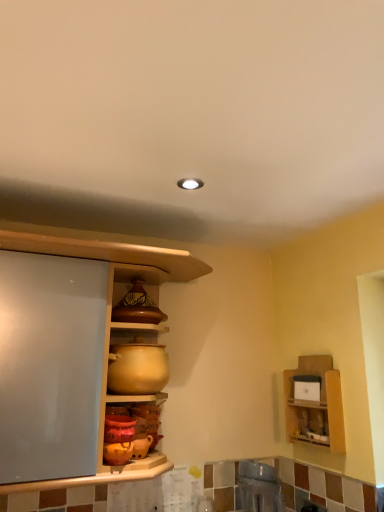
Question: From the image's perspective, is metallic stainless steel sink at lower center, which is the second appliance in left-to-right order, located beneath wooden shelf at upper right?

Choices:
 (A) yes
 (B) no

Answer: (A)

Question: Is metallic stainless steel sink at lower center, which appears as the first appliance when ordered from the bottom, positioned in front of wooden shelf at upper right?

Choices:
 (A) no
 (B) yes

Answer: (B)

Question: Considering the relative sizes of metallic stainless steel sink at lower center, which appears as the first appliance when ordered from the bottom, and wooden shelf at upper right in the image provided, is metallic stainless steel sink at lower center, which appears as the first appliance when ordered from the bottom, taller than wooden shelf at upper right?

Choices:
 (A) no
 (B) yes

Answer: (A)

Question: Does metallic stainless steel sink at lower center, which appears as the first appliance when ordered from the bottom, appear on the right side of wooden shelf at upper right?

Choices:
 (A) yes
 (B) no

Answer: (B)

Question: Is metallic stainless steel sink at lower center, placed as the 1th appliance when sorted from right to left, facing towards wooden shelf at upper right?

Choices:
 (A) no
 (B) yes

Answer: (A)

Question: In the image, is wooden shelf at upper right positioned in front of or behind matte brown ceramic pot at upper center?

Choices:
 (A) front
 (B) behind

Answer: (B)

Question: From a real-world perspective, is wooden shelf at upper right physically located above or below matte brown ceramic pot at upper center?

Choices:
 (A) below
 (B) above

Answer: (A)

Question: In terms of height, does wooden shelf at upper right look taller or shorter compared to matte brown ceramic pot at upper center?

Choices:
 (A) tall
 (B) short

Answer: (A)

Question: Based on their sizes in the image, would you say wooden shelf at upper right is bigger or smaller than matte brown ceramic pot at upper center?

Choices:
 (A) small
 (B) big

Answer: (B)

Question: In terms of width, does matte ceramic pot at center, the second appliance ordered from the bottom, look wider or thinner when compared to matte wood cabinet at center?

Choices:
 (A) wide
 (B) thin

Answer: (B)

Question: From a real-world perspective, is matte ceramic pot at center, placed as the 1th appliance when sorted from left to right, above or below matte wood cabinet at center?

Choices:
 (A) below
 (B) above

Answer: (A)

Question: Relative to matte wood cabinet at center, is matte ceramic pot at center, which appears as the second appliance when viewed from the right, in front or behind?

Choices:
 (A) front
 (B) behind

Answer: (B)

Question: Is matte ceramic pot at center, which appears as the second appliance when viewed from the right, taller or shorter than matte wood cabinet at center?

Choices:
 (A) short
 (B) tall

Answer: (A)

Question: Considering the positions of point coord(339,407) and point coord(243,474), is point coord(339,407) closer or farther from the camera than point coord(243,474)?

Choices:
 (A) closer
 (B) farther

Answer: (A)

Question: From a real-world perspective, is wooden shelf at upper right positioned above or below metallic stainless steel sink at lower center, placed as the 1th appliance when sorted from right to left?

Choices:
 (A) below
 (B) above

Answer: (B)